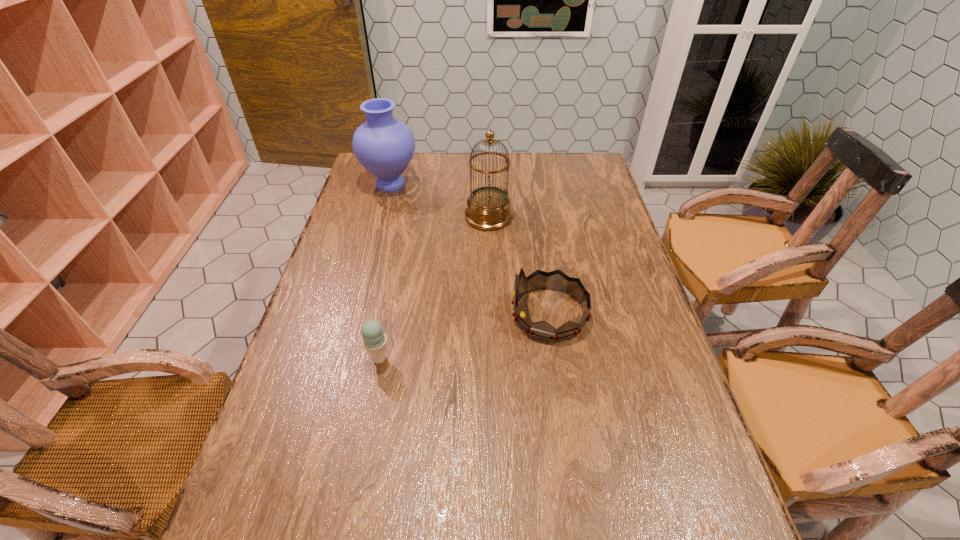
Where is `vacant space situated at the front of the third farthest object with jewels`? The width and height of the screenshot is (960, 540). vacant space situated at the front of the third farthest object with jewels is located at coordinates (368, 314).

Locate an element on the screen. The width and height of the screenshot is (960, 540). vacant space located on the right of the nearest object is located at coordinates (532, 359).

Find the location of a particular element. This screenshot has height=540, width=960. object that is at the far edge is located at coordinates (384, 146).

Identify the location of object that is at the left edge. (384, 146).

Where is `object that is at the far left corner`? The width and height of the screenshot is (960, 540). object that is at the far left corner is located at coordinates (384, 146).

The image size is (960, 540). In the image, there is a desktop. Find the location of `vacant space at the far edge`. vacant space at the far edge is located at coordinates (490, 158).

Image resolution: width=960 pixels, height=540 pixels. Find the location of `vacant area at the left edge of the desktop`. vacant area at the left edge of the desktop is located at coordinates (358, 199).

The image size is (960, 540). In order to click on free point at the right edge in this screenshot , I will do `click(611, 294)`.

This screenshot has height=540, width=960. Identify the location of blank space at the far right corner of the desktop. (578, 160).

Find the location of a particular element. vacant region between the farthest object and the birdcage is located at coordinates (440, 200).